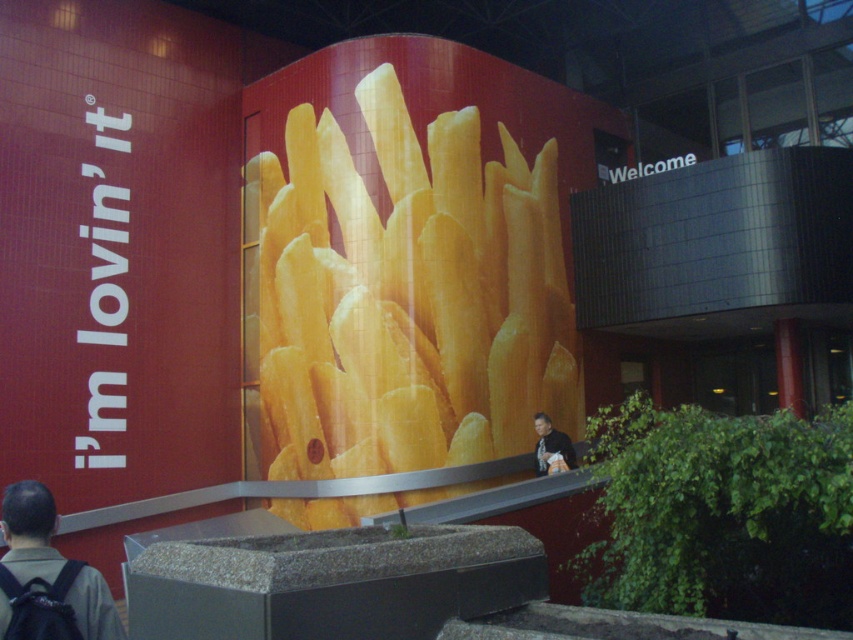
Question: Which point is farther from the camera taking this photo?

Choices:
 (A) (47, 636)
 (B) (323, 396)
 (C) (556, 445)

Answer: (B)

Question: Is golden crispy french fries at center further to the viewer compared to light brown leather jacket at lower center?

Choices:
 (A) yes
 (B) no

Answer: (A)

Question: Which object is the farthest from the golden crispy french fries at center?

Choices:
 (A) light brown leather jacket at lower center
 (B) dark gray backpack at lower left

Answer: (B)

Question: Considering the real-world distances, which object is closest to the light brown leather jacket at lower center?

Choices:
 (A) dark gray backpack at lower left
 (B) golden crispy french fries at center

Answer: (B)

Question: In this image, where is golden crispy french fries at center located relative to light brown leather jacket at lower center?

Choices:
 (A) right
 (B) left

Answer: (A)

Question: Is golden crispy french fries at center in front of dark gray backpack at lower left?

Choices:
 (A) yes
 (B) no

Answer: (B)